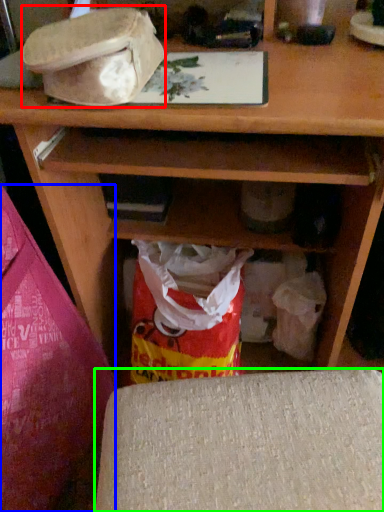
Question: Estimate the real-world distances between objects in this image. Which object is closer to hat (highlighted by a red box), leftover (highlighted by a blue box) or furniture (highlighted by a green box)?

Choices:
 (A) leftover
 (B) furniture

Answer: (A)